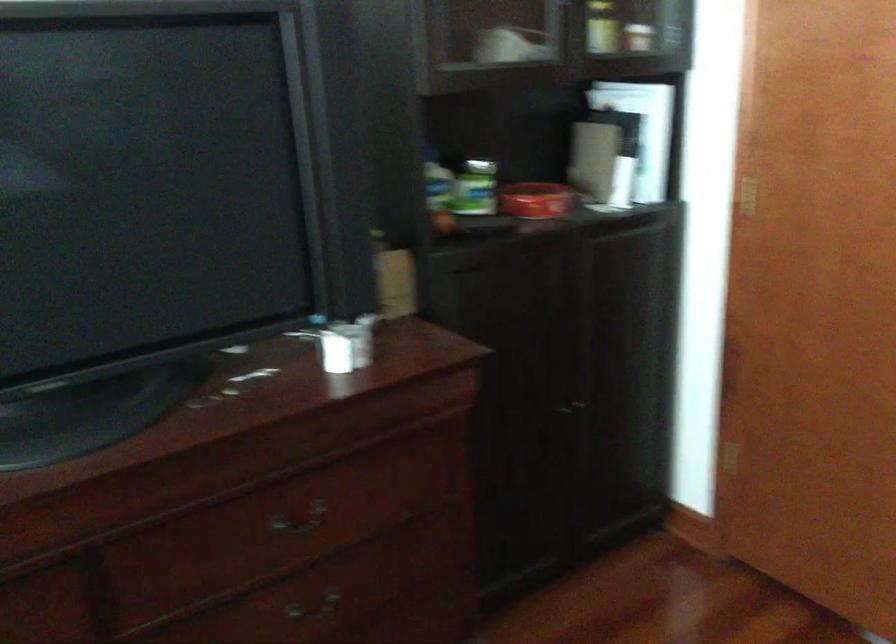
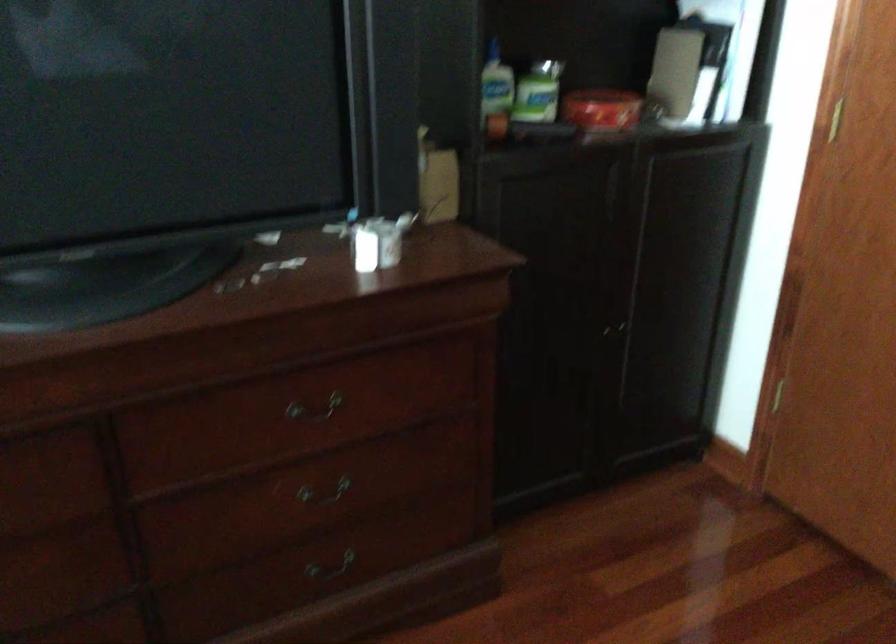
Find the pixel in the second image that matches (x=349, y=343) in the first image.

(378, 242)